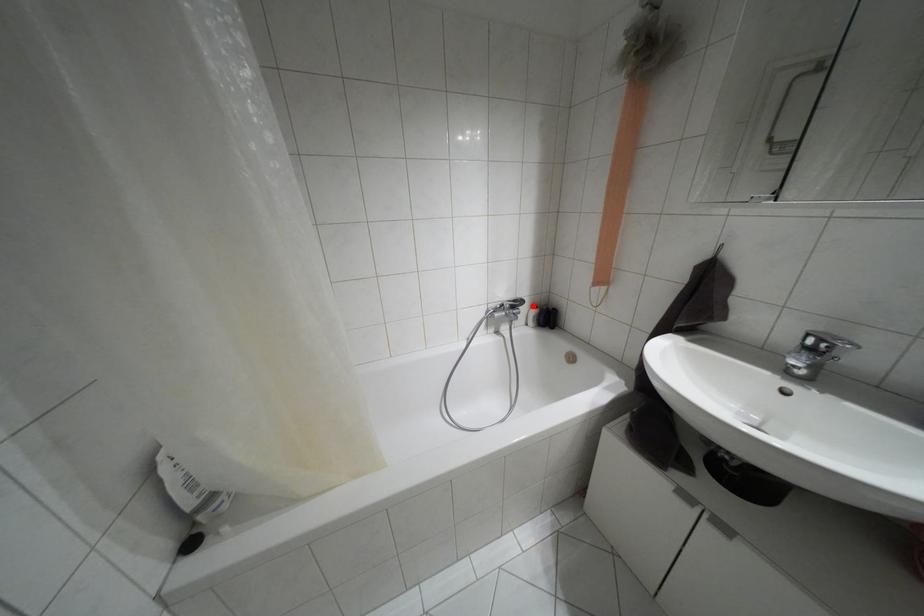
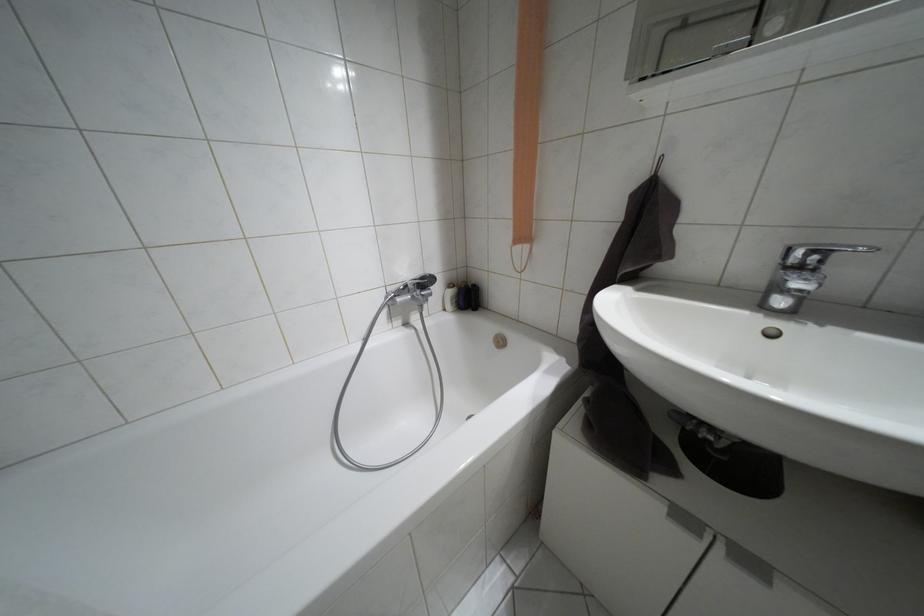
Question: I am providing you with two images of the same scene from different viewpoints. Image1 has a red point marked. In image2, the corresponding 3D location appears at what relative position? Reply with the corresponding letter.

Choices:
 (A) Closer
 (B) Farther

Answer: (A)